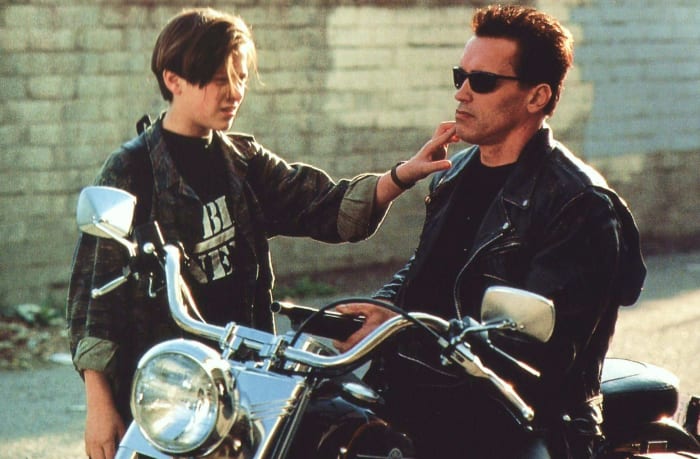
Where is `wall`? wall is located at coordinates click(617, 99).